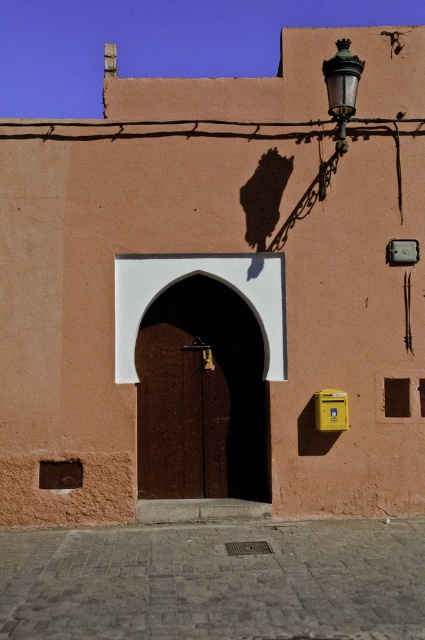
You are standing 20 feet away from the building and want to reach the point marked at coordinates point [193,266] on the wall. How much further do you need to walk towards the building to be exactly at that point?

The point marked at coordinates point [193,266] is 26.71 feet away from the viewer. Since you are currently 20 feet away, you need to walk an additional 6.71 feet towards the building to reach that point.

You are standing in front of the building shown in the image. You need to locate the brown wooden door at center. According to the coordinates provided, where exactly should you look to find it?

The brown wooden door at center is located at coordinates point (209, 276).

You are a delivery person approaching the building and need to reach the brown wooden door at center. There is a green glass streetlamp at upper right in your way. Can you walk straight to the door without moving around the streetlamp?

The green glass streetlamp at upper right is behind the brown wooden door at center, so it is not in your path. You can walk straight to the brown wooden door at center without needing to move around the streetlamp.